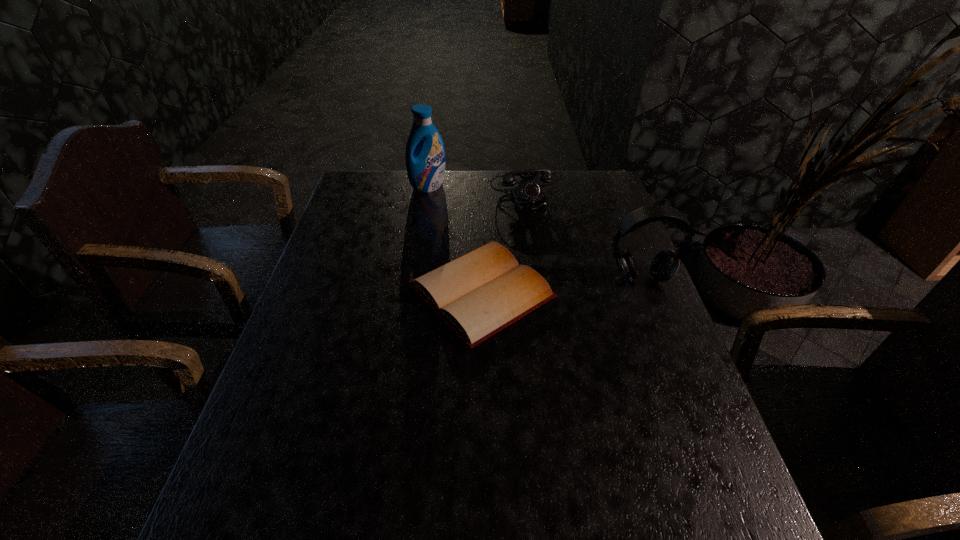
At what (x,y) coordinates should I click in order to perform the action: click on free region located on the front-facing side of the detergent. Please return your answer as a coordinate pair (x, y). The image size is (960, 540). Looking at the image, I should click on (456, 207).

The width and height of the screenshot is (960, 540). What are the coordinates of `vacant space located on the front-facing side of the detergent` in the screenshot? It's located at (509, 251).

Where is `vacant space located 0.080m on the front-facing side of the detergent`? vacant space located 0.080m on the front-facing side of the detergent is located at coordinates (451, 203).

In order to click on telephone that is at the far edge in this screenshot , I will do `click(528, 196)`.

You are a GUI agent. You are given a task and a screenshot of the screen. Output one action in this format:
    pyautogui.click(x=<x>, y=<y>)
    Task: Click on the detergent present at the far edge
    This screenshot has height=540, width=960.
    Given the screenshot: What is the action you would take?
    pyautogui.click(x=425, y=164)

At what (x,y) coordinates should I click in order to perform the action: click on object located in the right edge section of the desktop. Please return your answer as a coordinate pair (x, y). This screenshot has width=960, height=540. Looking at the image, I should click on (665, 263).

In the image, there is a desktop. Find the location of `vacant space at the far edge`. vacant space at the far edge is located at coordinates (458, 195).

At what (x,y) coordinates should I click in order to perform the action: click on free space at the left edge. Please return your answer as a coordinate pair (x, y). Looking at the image, I should click on [x=379, y=209].

Locate an element on the screen. The image size is (960, 540). vacant space at the right edge is located at coordinates (691, 437).

Find the location of a particular element. Image resolution: width=960 pixels, height=540 pixels. vacant area at the far left corner is located at coordinates (354, 172).